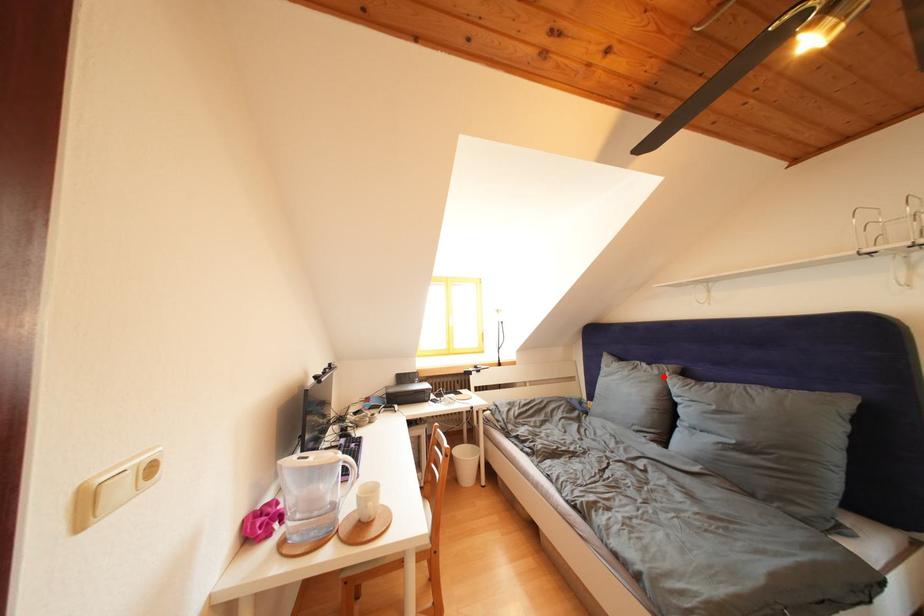
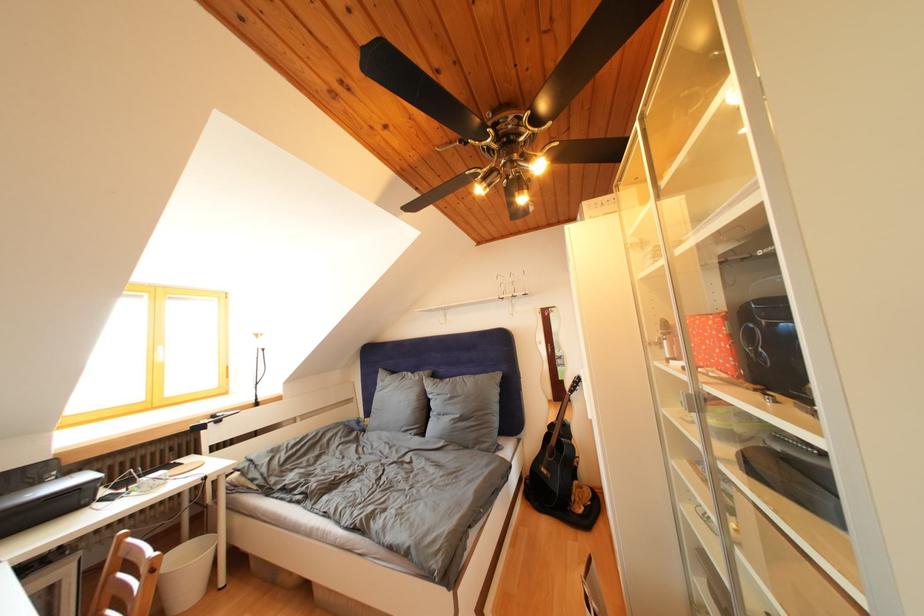
Locate, in the second image, the point that corresponds to the highlighted location in the first image.

(426, 383)